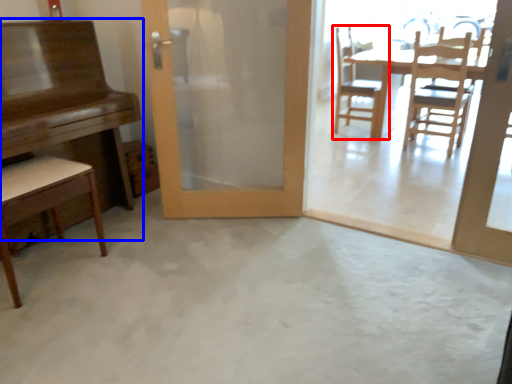
Question: Among these objects, which one is farthest to the camera, chair (highlighted by a red box) or table (highlighted by a blue box)?

Choices:
 (A) chair
 (B) table

Answer: (A)